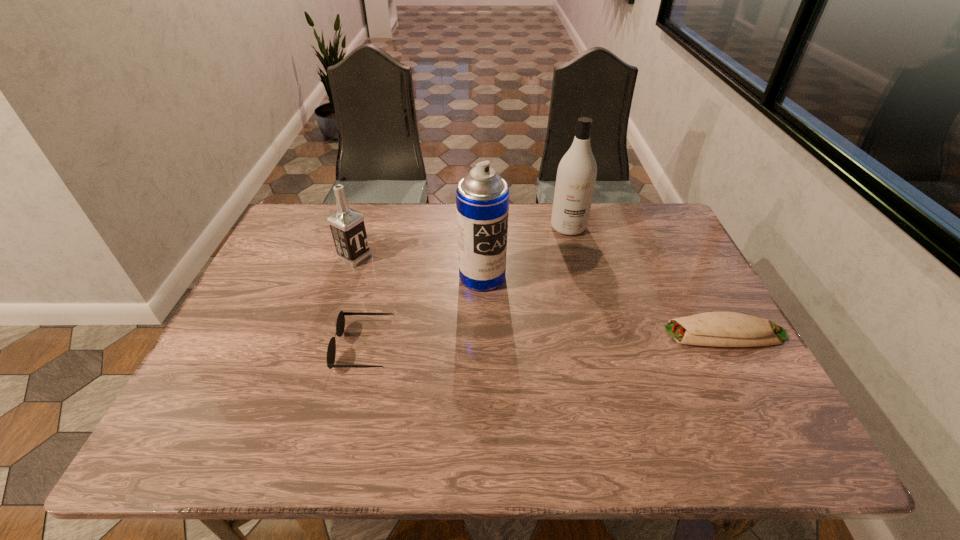
Where is `free region located 0.240m on the front-facing side of the farthest object`? The width and height of the screenshot is (960, 540). free region located 0.240m on the front-facing side of the farthest object is located at coordinates (575, 291).

You are a GUI agent. You are given a task and a screenshot of the screen. Output one action in this format:
    pyautogui.click(x=<x>, y=<y>)
    Task: Click on the free region located 0.200m on the front-facing side of the farthest object
    The height and width of the screenshot is (540, 960).
    Given the screenshot: What is the action you would take?
    pyautogui.click(x=574, y=281)

Where is `vodka positioned at the far edge`? This screenshot has height=540, width=960. vodka positioned at the far edge is located at coordinates (347, 226).

Where is `shampoo that is at the far edge`? Image resolution: width=960 pixels, height=540 pixels. shampoo that is at the far edge is located at coordinates (576, 176).

I want to click on object that is at the near edge, so click(340, 324).

Image resolution: width=960 pixels, height=540 pixels. Identify the location of object that is at the right edge. (720, 329).

Identify the location of free space at the far edge. (389, 205).

The height and width of the screenshot is (540, 960). In order to click on free space at the near edge in this screenshot , I will do `click(615, 397)`.

You are a GUI agent. You are given a task and a screenshot of the screen. Output one action in this format:
    pyautogui.click(x=<x>, y=<y>)
    Task: Click on the blank space at the left edge of the desktop
    The width and height of the screenshot is (960, 540).
    Given the screenshot: What is the action you would take?
    pyautogui.click(x=276, y=329)

At what (x,y) coordinates should I click in order to perform the action: click on free space at the far left corner. Please return your answer as a coordinate pair (x, y). This screenshot has height=540, width=960. Looking at the image, I should click on (322, 215).